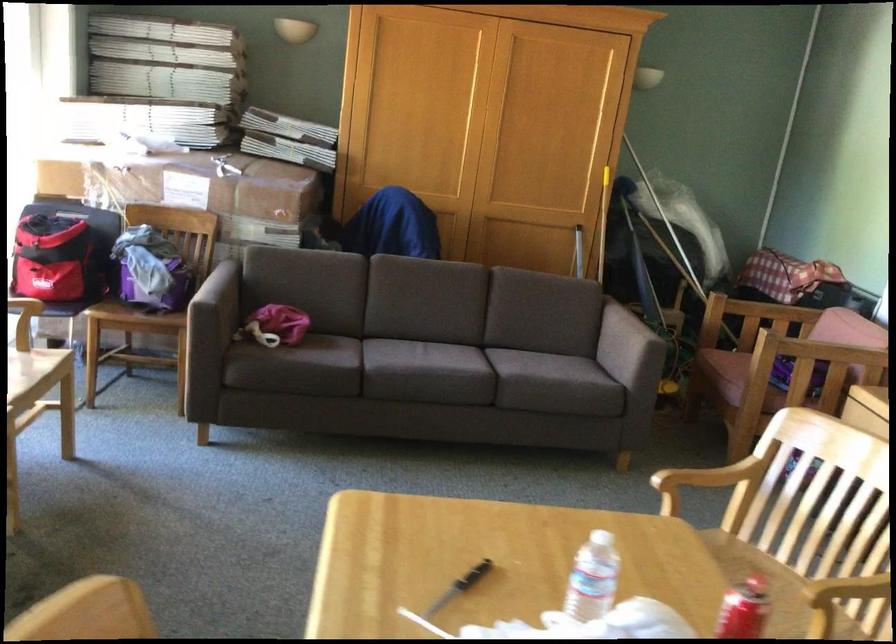
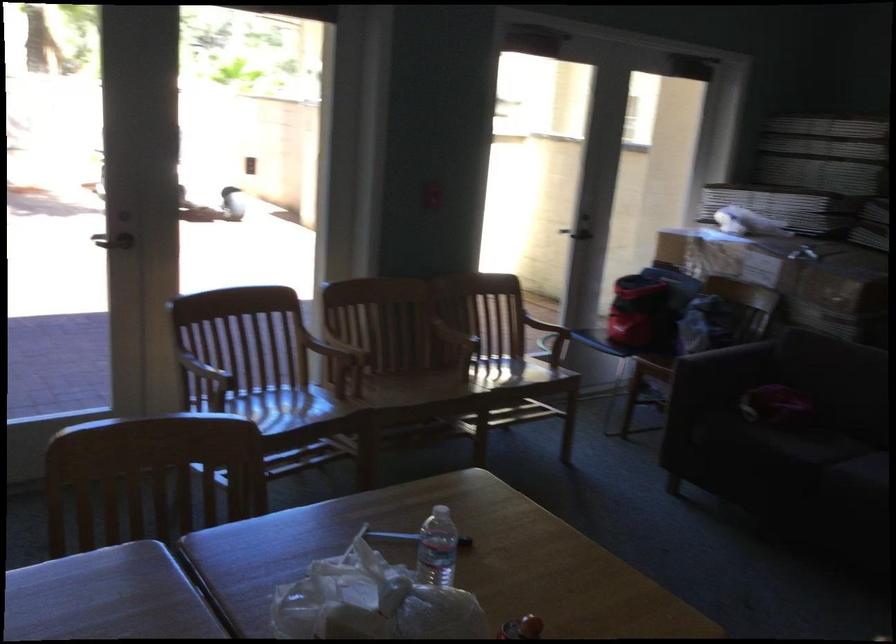
Find the pixel in the second image that matches [323,304] in the first image.

(843, 392)